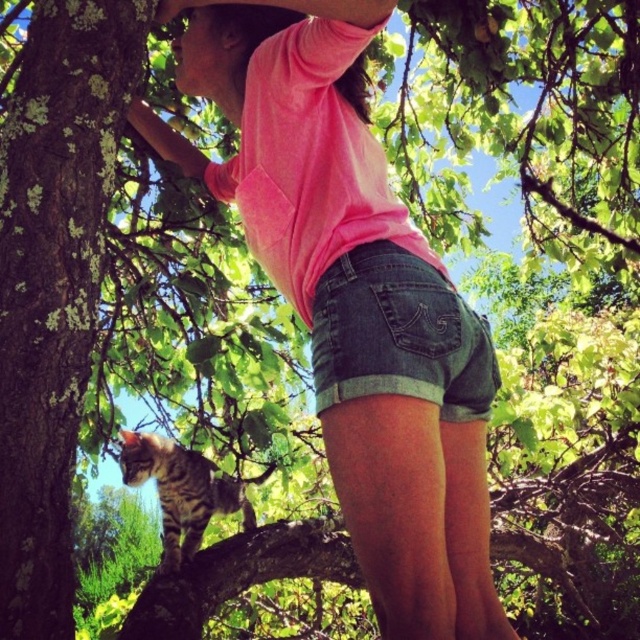
Question: Can you confirm if denim shorts at center is positioned above tabby fur cat at center?

Choices:
 (A) no
 (B) yes

Answer: (B)

Question: Which point is farther to the camera?

Choices:
 (A) tabby fur cat at center
 (B) denim shorts at center

Answer: (A)

Question: Which point appears closest to the camera in this image?

Choices:
 (A) (134, 440)
 (B) (413, 372)

Answer: (B)

Question: Is denim shorts at center wider than tabby fur cat at center?

Choices:
 (A) no
 (B) yes

Answer: (A)

Question: Can you confirm if denim shorts at center is wider than tabby fur cat at center?

Choices:
 (A) no
 (B) yes

Answer: (A)